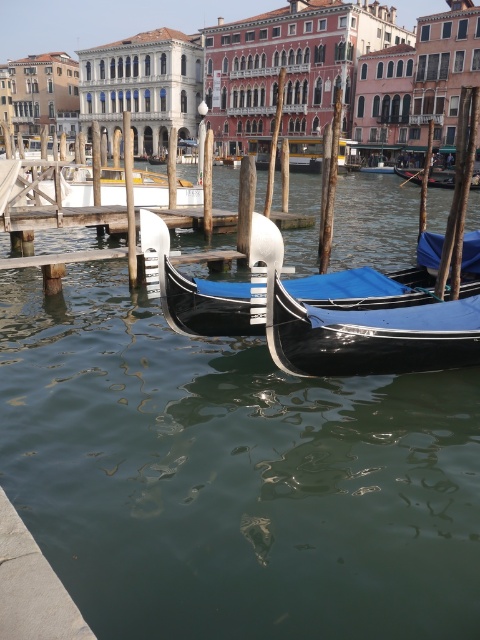
Can you confirm if shiny black gondola at center is shorter than wooden gondola at center?

Yes, shiny black gondola at center is shorter than wooden gondola at center.

Between point (169, 268) and point (121, 168), which one is positioned in front?

Point (169, 268) is in front.

Between point (432, 292) and point (116, 177), which one is positioned in front?

Point (432, 292) is in front.

You are a GUI agent. You are given a task and a screenshot of the screen. Output one action in this format:
    pyautogui.click(x=<x>, y=<y>)
    Task: Click on the shiny black gondola at center
    The width and height of the screenshot is (480, 640).
    Given the screenshot: What is the action you would take?
    pyautogui.click(x=196, y=291)

In the scene shown: Between wooden gondola at center and metallic silver gondola at center, which one is positioned lower?

wooden gondola at center is lower down.

Between point (156, 186) and point (266, 163), which one is positioned in front?

Positioned in front is point (156, 186).

Which is in front, point (197, 198) or point (294, 150)?

Point (197, 198) is in front.

This screenshot has width=480, height=640. Find the location of `wooden gondola at center`. wooden gondola at center is located at coordinates 76,186.

Who is lower down, metallic silver gondola at center or blue fabric gondola at center?

blue fabric gondola at center

Find the location of a particular element. metallic silver gondola at center is located at coordinates (304, 154).

Measure the distance between point (343, 161) and camera.

A distance of 90.95 meters exists between point (343, 161) and camera.

Identify the location of metallic silver gondola at center. (304, 154).